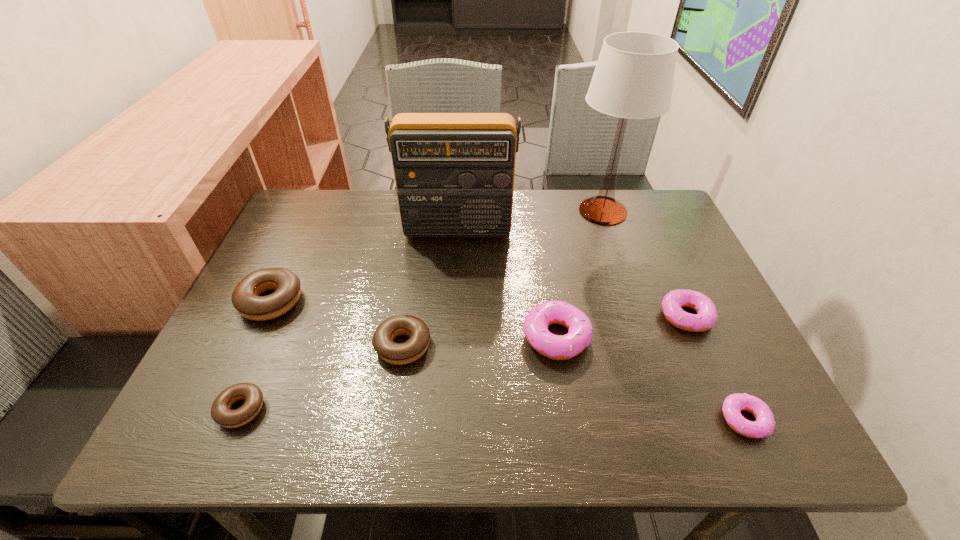
At what (x,y) coordinates should I click in order to perform the action: click on table lamp that is at the far edge. Please return your answer as a coordinate pair (x, y). Image resolution: width=960 pixels, height=540 pixels. Looking at the image, I should click on (633, 79).

I want to click on radio receiver that is at the far edge, so click(x=454, y=172).

Image resolution: width=960 pixels, height=540 pixels. In order to click on table lamp that is at the right edge in this screenshot , I will do `click(633, 79)`.

At what (x,y) coordinates should I click in order to perform the action: click on object located at the near left corner. Please return your answer as a coordinate pair (x, y). Looking at the image, I should click on (221, 413).

At what (x,y) coordinates should I click in order to perform the action: click on object located in the far right corner section of the desktop. Please return your answer as a coordinate pair (x, y). Image resolution: width=960 pixels, height=540 pixels. Looking at the image, I should click on (633, 79).

This screenshot has width=960, height=540. I want to click on object that is at the near right corner, so click(764, 426).

In the image, there is a desktop. Where is `vacant space at the far edge`? Image resolution: width=960 pixels, height=540 pixels. vacant space at the far edge is located at coordinates (561, 210).

Where is `free spot at the near edge of the desktop`? free spot at the near edge of the desktop is located at coordinates (668, 409).

Locate an element on the screen. This screenshot has width=960, height=540. vacant space at the left edge of the desktop is located at coordinates (228, 352).

In order to click on vacant point at the right edge in this screenshot , I will do `click(737, 372)`.